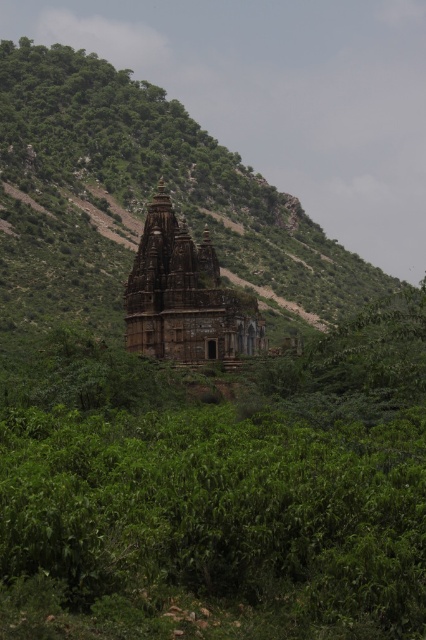
Question: Does green leafy mountain at center appear on the right side of brown stone hindu temple at center?

Choices:
 (A) no
 (B) yes

Answer: (A)

Question: Which object is farther from the camera taking this photo?

Choices:
 (A) green leafy mountain at center
 (B) brown stone hindu temple at center

Answer: (A)

Question: Is green leafy mountain at center below brown stone hindu temple at center?

Choices:
 (A) no
 (B) yes

Answer: (A)

Question: Which point is closer to the camera?

Choices:
 (A) green leafy mountain at center
 (B) brown stone hindu temple at center

Answer: (B)

Question: Observing the image, what is the correct spatial positioning of green leafy mountain at center in reference to brown stone hindu temple at center?

Choices:
 (A) below
 (B) above

Answer: (B)

Question: Which of the following is the farthest from the observer?

Choices:
 (A) brown stone hindu temple at center
 (B) green leafy mountain at center

Answer: (B)